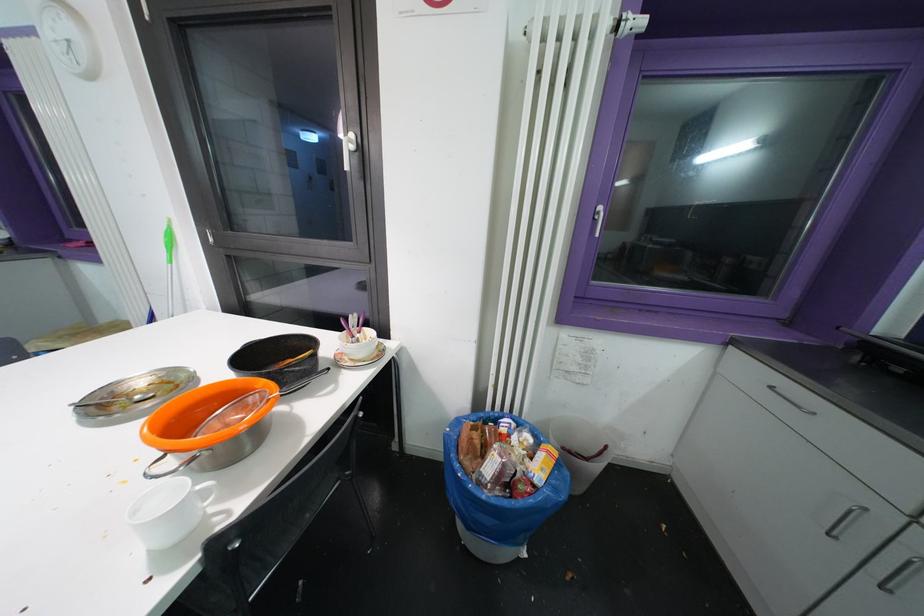
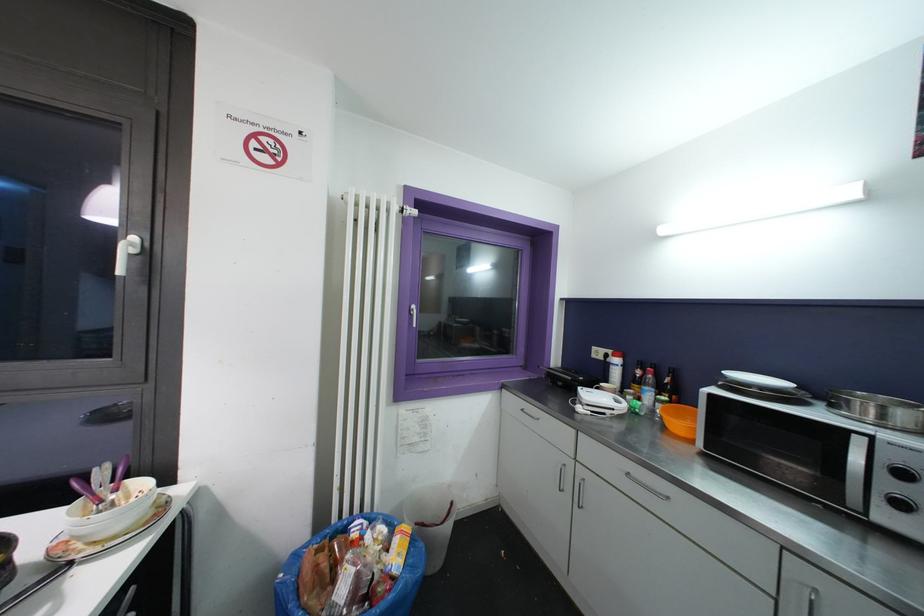
The point at (602, 216) is marked in the first image. Where is the corresponding point in the second image?

(416, 313)